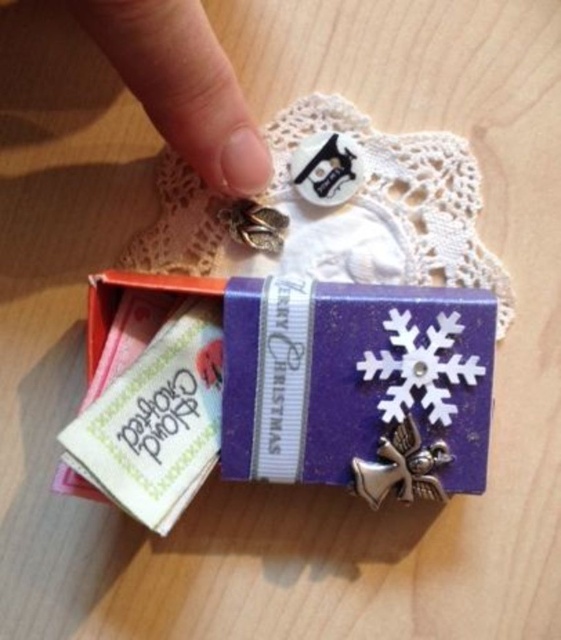
Can you confirm if purple shiny gift box at center is positioned to the right of white matte snowflake at center?

In fact, purple shiny gift box at center is to the left of white matte snowflake at center.

Does purple shiny gift box at center appear on the left side of white matte snowflake at center?

Correct, you'll find purple shiny gift box at center to the left of white matte snowflake at center.

Looking at this image, who is more forward, (135, 509) or (389, 368)?

Point (135, 509) is in front.

Locate an element on the screen. Image resolution: width=561 pixels, height=640 pixels. purple shiny gift box at center is located at coordinates (173, 401).

Who is positioned more to the left, purple shiny gift box at center or nail polish at upper center?

nail polish at upper center is more to the left.

Can you confirm if purple shiny gift box at center is positioned above nail polish at upper center?

Incorrect, purple shiny gift box at center is not positioned above nail polish at upper center.

Consider the image. Who is more forward, (167, 477) or (172, 141)?

Point (172, 141) is in front.

This screenshot has height=640, width=561. What are the coordinates of `purple shiny gift box at center` in the screenshot? It's located at (173, 401).

Between point (263, 161) and point (406, 381), which one is positioned in front?

Point (406, 381) is more forward.

Is nail polish at upper center to the right of white matte snowflake at center from the viewer's perspective?

In fact, nail polish at upper center is to the left of white matte snowflake at center.

The height and width of the screenshot is (640, 561). What do you see at coordinates (181, 84) in the screenshot?
I see `nail polish at upper center` at bounding box center [181, 84].

Find the location of `nail polish at upper center`. nail polish at upper center is located at coordinates (181, 84).